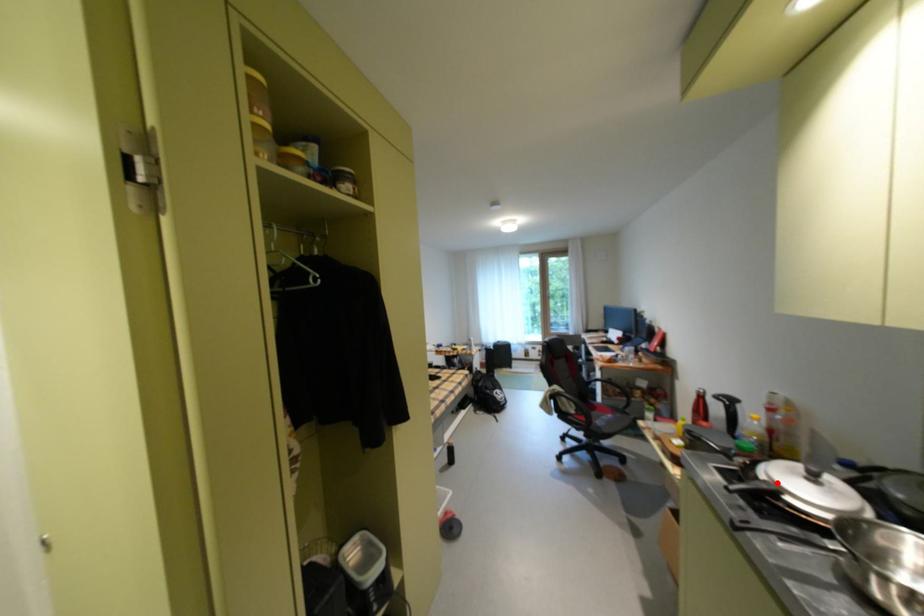
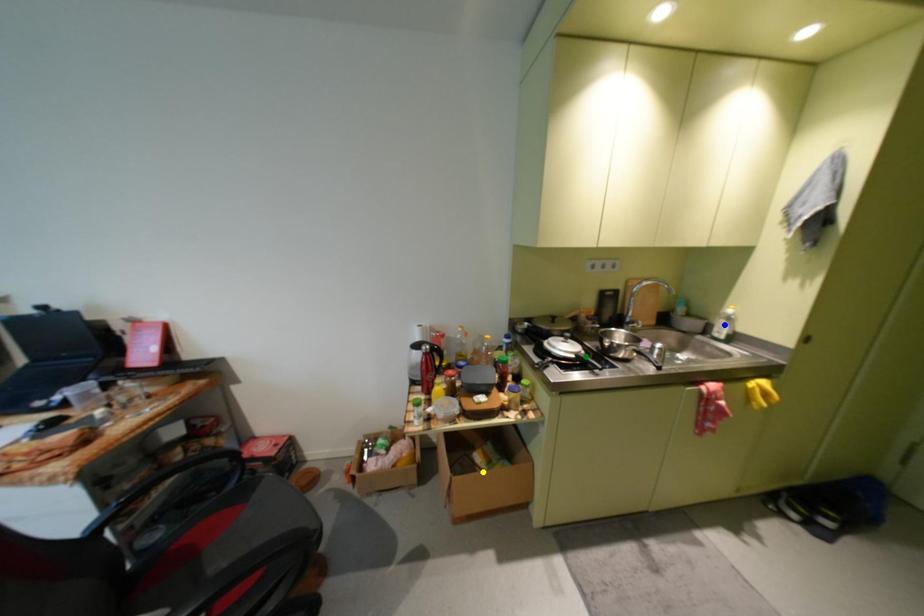
Question: I am providing you with two images of the same scene from different viewpoints. A red point is marked on the first image. You are given multiple points on the second image. Which mark in image 2 goes with the point in image 1?

Choices:
 (A) green point
 (B) yellow point
 (C) blue point

Answer: (A)